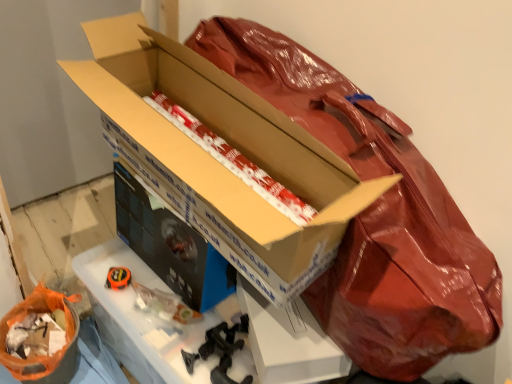
The image size is (512, 384). In order to click on vacant area on top of black cardboard workbench at center (from a real-world perspective) in this screenshot , I will do `click(168, 302)`.